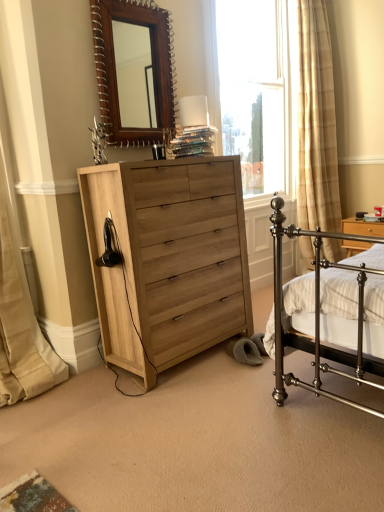
The width and height of the screenshot is (384, 512). Identify the location of free location above white glossy table lamp at upper center (from a real-world perspective). (187, 98).